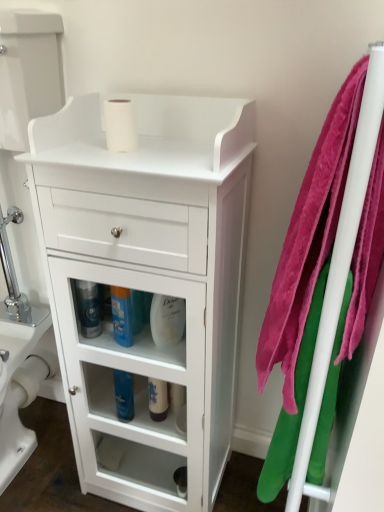
Question: From a real-world perspective, is pink plush towel at right, which is the 2th bath towel in left-to-right order, on white matte toilet paper at lower center, arranged as the second toilet paper when viewed from the front?

Choices:
 (A) no
 (B) yes

Answer: (B)

Question: Would you say pink plush towel at right, which is the 2th bath towel in left-to-right order, is outside white matte toilet paper at lower center, acting as the first toilet paper starting from the bottom?

Choices:
 (A) yes
 (B) no

Answer: (A)

Question: Is pink plush towel at right, the first bath towel viewed from the right, shorter than white matte toilet paper at lower center, acting as the first toilet paper starting from the bottom?

Choices:
 (A) yes
 (B) no

Answer: (B)

Question: From the image's perspective, is pink plush towel at right, the first bath towel viewed from the right, under white matte toilet paper at lower center, which appears as the first toilet paper when viewed from the back?

Choices:
 (A) yes
 (B) no

Answer: (B)

Question: Can you confirm if pink plush towel at right, the first bath towel viewed from the right, is wider than white matte toilet paper at lower center, acting as the second toilet paper starting from the right?

Choices:
 (A) no
 (B) yes

Answer: (B)

Question: Looking at their shapes, would you say white glossy cabinet at center is wider or thinner than white glossy bottle at center, positioned as the 1th cleaning product in right-to-left order?

Choices:
 (A) thin
 (B) wide

Answer: (B)

Question: From the image's perspective, is white glossy cabinet at center positioned above or below white glossy bottle at center, acting as the 5th cleaning product starting from the left?

Choices:
 (A) below
 (B) above

Answer: (A)

Question: From a real-world perspective, relative to white glossy bottle at center, acting as the 5th cleaning product starting from the left, is white glossy cabinet at center vertically above or below?

Choices:
 (A) below
 (B) above

Answer: (A)

Question: Is point (87, 422) positioned closer to the camera than point (172, 302)?

Choices:
 (A) closer
 (B) farther

Answer: (B)

Question: From the image's perspective, is blue glossy bottle at center, the 3th cleaning product when ordered from left to right, located above or below white glossy cabinet at center?

Choices:
 (A) below
 (B) above

Answer: (B)

Question: In terms of height, does blue glossy bottle at center, which is counted as the 3th cleaning product, starting from the right, look taller or shorter compared to white glossy cabinet at center?

Choices:
 (A) short
 (B) tall

Answer: (A)

Question: Is blue glossy bottle at center, the 3th cleaning product when ordered from left to right, bigger or smaller than white glossy cabinet at center?

Choices:
 (A) big
 (B) small

Answer: (B)

Question: In the image, is blue glossy bottle at center, which is counted as the 3th cleaning product, starting from the right, on the left side or the right side of white glossy cabinet at center?

Choices:
 (A) left
 (B) right

Answer: (A)

Question: Considering the positions of point (150, 394) and point (122, 408), is point (150, 394) closer or farther from the camera than point (122, 408)?

Choices:
 (A) farther
 (B) closer

Answer: (A)

Question: Choose the correct answer: Is white glossy bottle at center, which is the 4th cleaning product from left to right, inside blue glossy bottle at lower center, which ranks as the 4th cleaning product in right-to-left order, or outside it?

Choices:
 (A) outside
 (B) inside

Answer: (A)